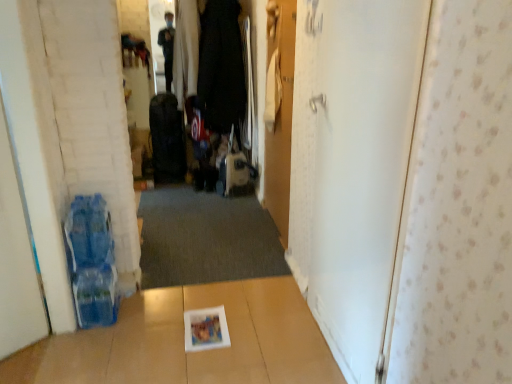
Describe the element at coordinates (206, 329) in the screenshot. This screenshot has height=384, width=512. I see `white glossy magazine at center` at that location.

What do you see at coordinates (167, 139) in the screenshot? This screenshot has height=384, width=512. I see `black fabric suitcase at center, the second luggage when ordered from right to left` at bounding box center [167, 139].

At what (x,y) coordinates should I click in order to perform the action: click on white matte door at right, which is the third door in left-to-right order. Please return your answer as a coordinate pair (x, y). The image size is (512, 384). Looking at the image, I should click on (352, 164).

Describe the element at coordinates (17, 255) in the screenshot. I see `white matte door at left, which is the first door in left-to-right order` at that location.

Describe the element at coordinates (234, 171) in the screenshot. I see `matte black suitcase at center, arranged as the 1th luggage when viewed from the right` at that location.

In order to face matte black suitcase at center, arranged as the 1th luggage when viewed from the right, should I rotate leftwards or rightwards?

To face it directly, rotate left by 2.924 degrees.

What do you see at coordinates (206, 239) in the screenshot?
I see `dark gray carpet at center` at bounding box center [206, 239].

The width and height of the screenshot is (512, 384). Find the location of `white glossy magazine at center`. white glossy magazine at center is located at coordinates (206, 329).

Does dark gray carpet at center have a lesser width compared to white matte door at left, which is the first door in left-to-right order?

Incorrect, the width of dark gray carpet at center is not less than that of white matte door at left, which is the first door in left-to-right order.

From the image's perspective, which is below, dark gray carpet at center or white matte door at left, acting as the third door starting from the right?

dark gray carpet at center.

Between point (197, 323) and point (284, 132), which one is positioned in front?

Positioned in front is point (197, 323).

How distant is white glossy magazine at center from wooden door at center, acting as the second door starting from the right?

white glossy magazine at center is 1.12 meters from wooden door at center, acting as the second door starting from the right.

Would you consider white glossy magazine at center to be distant from wooden door at center, acting as the second door starting from the right?

That's right, there is a large distance between white glossy magazine at center and wooden door at center, acting as the second door starting from the right.

Is wooden door at center, the 2th door from the left, inside white glossy magazine at center?

No.

Would you say white glossy magazine at center is a long distance from white matte door at left, acting as the third door starting from the right?

No, white glossy magazine at center is not far away from white matte door at left, acting as the third door starting from the right.

Which is closer to the camera, (197, 345) or (9, 210)?

Point (197, 345) is farther from the camera than point (9, 210).

Could you tell me if white glossy magazine at center is facing white matte door at left, which is the first door in left-to-right order?

No, white glossy magazine at center is not turned towards white matte door at left, which is the first door in left-to-right order.

Which object is thinner, white matte door at right, which is the third door in left-to-right order, or white glossy magazine at center?

Thinner between the two is white matte door at right, which is the third door in left-to-right order.

Considering the positions of objects white matte door at right, the 1th door when ordered from right to left, and white glossy magazine at center in the image provided, who is more to the right, white matte door at right, the 1th door when ordered from right to left, or white glossy magazine at center?

Positioned to the right is white matte door at right, the 1th door when ordered from right to left.

Between white matte door at right, the 1th door when ordered from right to left, and white glossy magazine at center, which one has more height?

With more height is white matte door at right, the 1th door when ordered from right to left.

Is white glossy magazine at center at the back of white matte door at right, the 1th door when ordered from right to left?

No, white matte door at right, the 1th door when ordered from right to left, is not facing away from white glossy magazine at center.

Which object is more forward, wooden door at center, the 2th door from the left, or dark gray carpet at center?

wooden door at center, the 2th door from the left.

Is wooden door at center, the 2th door from the left, smaller than dark gray carpet at center?

Yes, wooden door at center, the 2th door from the left, is smaller than dark gray carpet at center.

Would you say wooden door at center, the 2th door from the left, contains dark gray carpet at center?

That's incorrect, dark gray carpet at center is not inside wooden door at center, the 2th door from the left.

Is wooden door at center, acting as the second door starting from the right, beside dark gray carpet at center?

wooden door at center, acting as the second door starting from the right, is not next to dark gray carpet at center, and they're not touching.

How much distance is there between white glossy magazine at center and white matte door at right, which is the third door in left-to-right order?

A distance of 33.98 inches exists between white glossy magazine at center and white matte door at right, which is the third door in left-to-right order.

What's the angular difference between white glossy magazine at center and white matte door at right, which is the third door in left-to-right order,'s facing directions?

There is a 91.9-degree angle between the facing directions of white glossy magazine at center and white matte door at right, which is the third door in left-to-right order.

Find the location of a particular element. The width and height of the screenshot is (512, 384). magazine below the white matte door at right, which is the third door in left-to-right order (from the image's perspective) is located at coordinates (206, 329).

Considering the sizes of objects white glossy magazine at center and white matte door at right, which is the third door in left-to-right order, in the image provided, who is thinner, white glossy magazine at center or white matte door at right, which is the third door in left-to-right order,?

Thinner between the two is white matte door at right, which is the third door in left-to-right order.

Between black fabric suitcase at center, the second luggage when ordered from right to left, and dark gray carpet at center, which one has more height?

Standing taller between the two is black fabric suitcase at center, the second luggage when ordered from right to left.

Does point (158, 171) come behind point (155, 207)?

Yes, it is.

Does black fabric suitcase at center, the 1th luggage in the left-to-right sequence, have a larger size compared to dark gray carpet at center?

Yes, black fabric suitcase at center, the 1th luggage in the left-to-right sequence, is bigger than dark gray carpet at center.

Is black fabric suitcase at center, the 1th luggage in the left-to-right sequence, far away from dark gray carpet at center?

No, black fabric suitcase at center, the 1th luggage in the left-to-right sequence, is not far from dark gray carpet at center.

Identify the location of door on the left side of dark gray carpet at center. (17, 255).

The width and height of the screenshot is (512, 384). What are the coordinates of `door that is the 3rd object above the white glossy magazine at center (from a real-world perspective)` in the screenshot? It's located at (280, 113).

From the image, which object appears to be farther from white glossy magazine at center, matte black suitcase at center, which is counted as the second luggage, starting from the left, or wooden door at center, acting as the second door starting from the right?

matte black suitcase at center, which is counted as the second luggage, starting from the left, is further to white glossy magazine at center.

Looking at this image, which object lies further to the anchor point white matte door at left, which is the first door in left-to-right order, white matte door at right, which is the third door in left-to-right order, or white glossy magazine at center?

white matte door at right, which is the third door in left-to-right order, lies further to white matte door at left, which is the first door in left-to-right order, than the other object.

Estimate the real-world distances between objects in this image. Which object is closer to black fabric suitcase at center, the second luggage when ordered from right to left, white matte door at right, the 1th door when ordered from right to left, or wooden door at center, acting as the second door starting from the right?

wooden door at center, acting as the second door starting from the right, is closer to black fabric suitcase at center, the second luggage when ordered from right to left.

Considering their positions, is dark gray carpet at center positioned closer to matte black suitcase at center, which is counted as the second luggage, starting from the left, than black fabric suitcase at center, the second luggage when ordered from right to left?

black fabric suitcase at center, the second luggage when ordered from right to left, lies closer to matte black suitcase at center, which is counted as the second luggage, starting from the left, than the other object.

Looking at this image, estimate the real-world distances between objects in this image. Which object is closer to matte black suitcase at center, arranged as the 1th luggage when viewed from the right, white glossy magazine at center or dark gray carpet at center?

dark gray carpet at center is positioned closer to the anchor matte black suitcase at center, arranged as the 1th luggage when viewed from the right.

Looking at the image, which one is located further to white glossy magazine at center, white matte door at right, which is the third door in left-to-right order, or dark gray carpet at center?

white matte door at right, which is the third door in left-to-right order.

Estimate the real-world distances between objects in this image. Which object is further from white matte door at right, which is the third door in left-to-right order, white glossy magazine at center or white matte door at left, acting as the third door starting from the right?

Among the two, white matte door at left, acting as the third door starting from the right, is located further to white matte door at right, which is the third door in left-to-right order.

Looking at this image, when comparing their distances from white matte door at right, the 1th door when ordered from right to left, does dark gray carpet at center or black fabric suitcase at center, the second luggage when ordered from right to left, seem closer?

The object closer to white matte door at right, the 1th door when ordered from right to left, is dark gray carpet at center.

Image resolution: width=512 pixels, height=384 pixels. Identify the location of doormat between white matte door at left, which is the first door in left-to-right order, and matte black suitcase at center, which is counted as the second luggage, starting from the left, in the front-back direction. (206, 239).

Locate an element on the screen. The image size is (512, 384). luggage between dark gray carpet at center and black fabric suitcase at center, the 1th luggage in the left-to-right sequence, in the front-back direction is located at coordinates (234, 171).

Where is `doormat between white matte door at left, acting as the third door starting from the right, and black fabric suitcase at center, the 1th luggage in the left-to-right sequence, in the front-back direction`? Image resolution: width=512 pixels, height=384 pixels. doormat between white matte door at left, acting as the third door starting from the right, and black fabric suitcase at center, the 1th luggage in the left-to-right sequence, in the front-back direction is located at coordinates (206, 239).

The width and height of the screenshot is (512, 384). In order to click on magazine between white matte door at right, the 1th door when ordered from right to left, and matte black suitcase at center, which is counted as the second luggage, starting from the left, along the z-axis in this screenshot , I will do `click(206, 329)`.